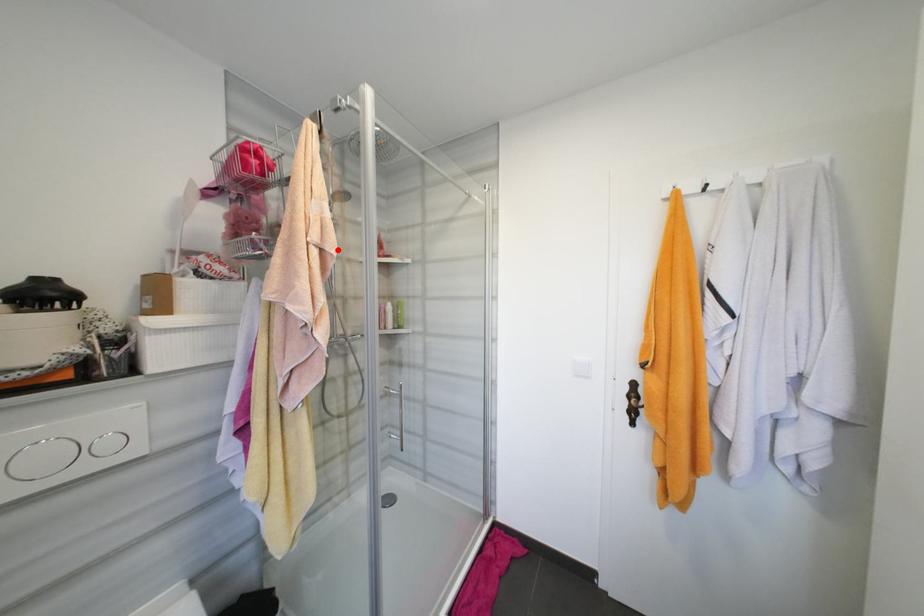
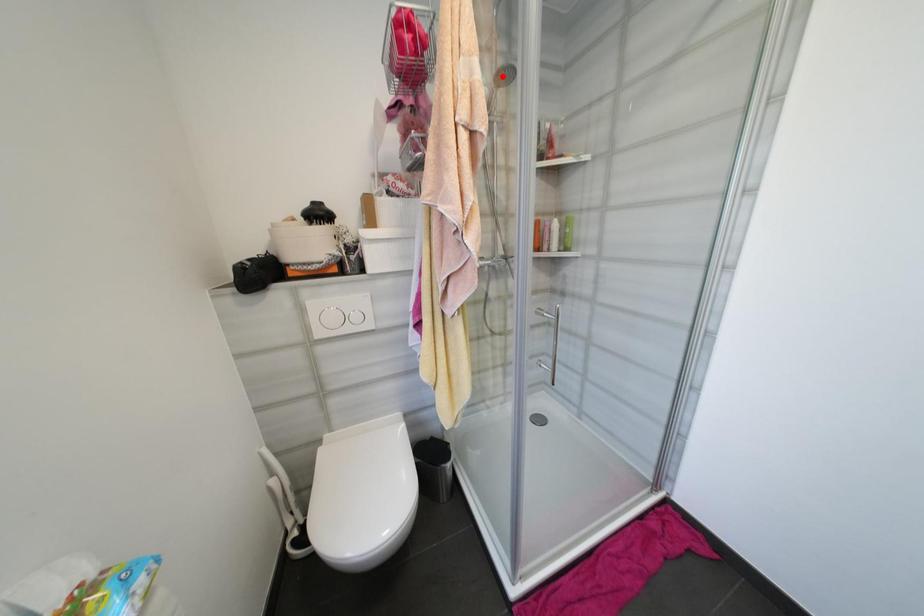
I am providing you with two images of the same scene from different viewpoints. A red point is marked on the first image and another point is marked on the second image. Does the point marked in image1 correspond to the same location as the one in image2?

No